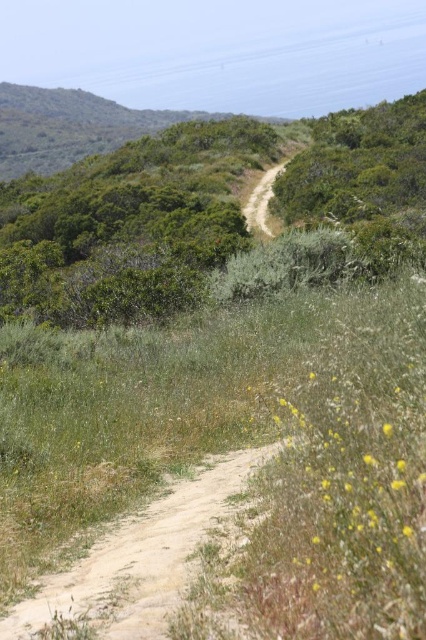
You are a hiker standing at the starting point of the dirt path. You see the green leafy shrubs at upper left in the image. Based on their 2D location, which direction should you face to look towards them?

The green leafy shrubs at upper left are located at point (206, 211) in the image, which is towards the upper left direction. To face them, you should turn your body to look towards the upper left direction from your current position.

You are a hiker trying to find the dirt path at center in this landscape. There are green leafy shrubs at upper left nearby. Which direction should you move relative to the shrubs to reach the path?

The dirt path at center is above the green leafy shrubs at upper left, so you should move upward from the shrubs to reach the path.